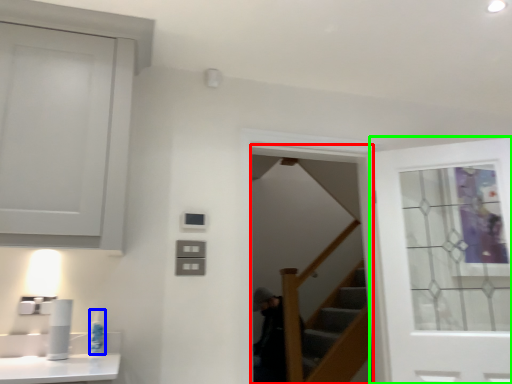
Question: Considering the real-world distances, which object is closest to screen door (highlighted by a red box)? toiletry (highlighted by a blue box) or door (highlighted by a green box).

Choices:
 (A) toiletry
 (B) door

Answer: (B)